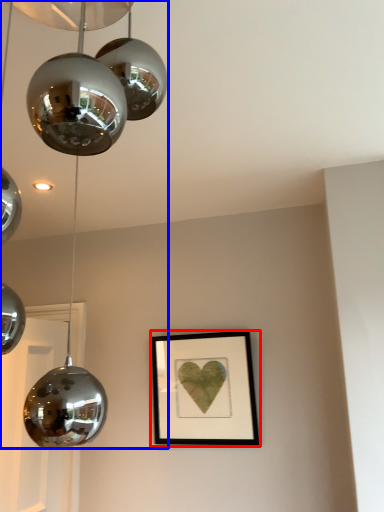
Question: Among these objects, which one is nearest to the camera, picture frame (highlighted by a red box) or lamp (highlighted by a blue box)?

Choices:
 (A) picture frame
 (B) lamp

Answer: (B)